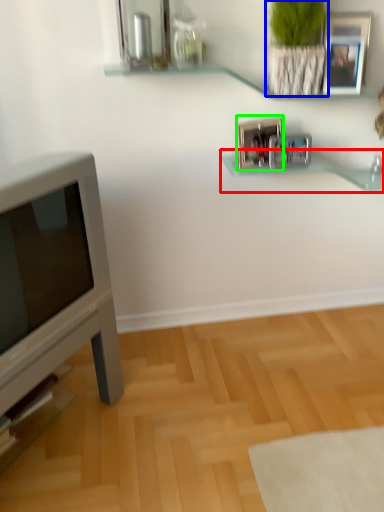
Question: Which is nearer to the shelf (highlighted by a red box)? plant (highlighted by a blue box) or picture frame (highlighted by a green box).

Choices:
 (A) plant
 (B) picture frame

Answer: (B)